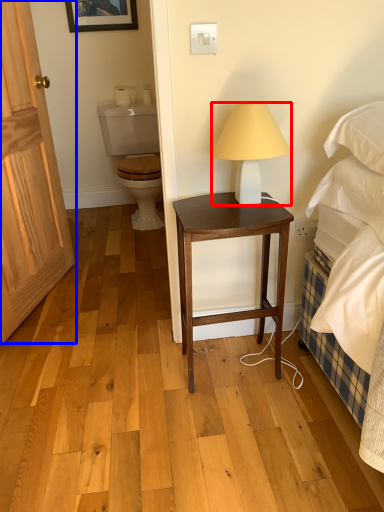
Question: Which object appears farthest to the camera in this image, lamp (highlighted by a red box) or door (highlighted by a blue box)?

Choices:
 (A) lamp
 (B) door

Answer: (B)